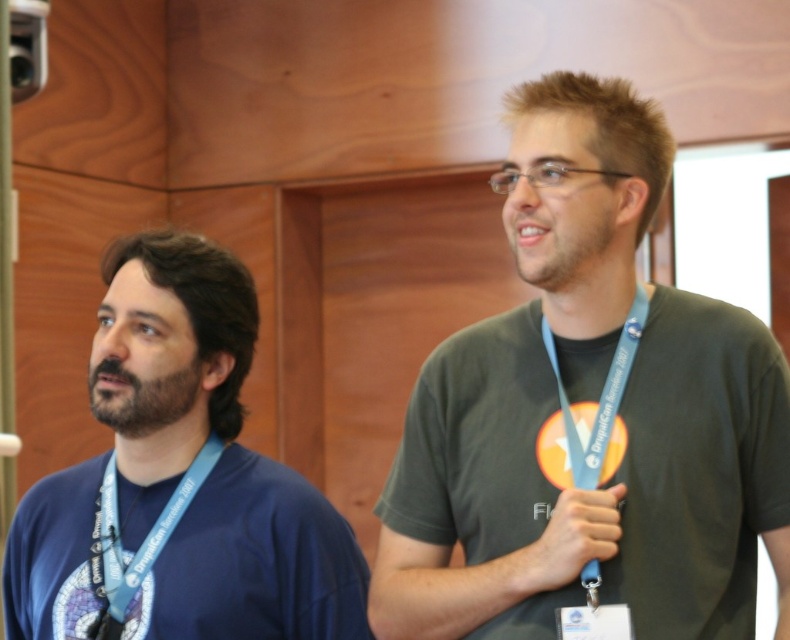
Does matte gray lanyard at center appear under blue fabric lanyard at left?

No, matte gray lanyard at center is not below blue fabric lanyard at left.

From the picture: Who is more distant from viewer, (x=574, y=266) or (x=92, y=572)?

The point (x=92, y=572) is behind.

Does point (576, 328) lie behind point (104, 490)?

No, it is not.

Image resolution: width=790 pixels, height=640 pixels. What are the coordinates of `matte gray lanyard at center` in the screenshot? It's located at pos(585,276).

Looking at this image, does blue fabric lanyard at left appear on the left side of blue fabric lanyard at right?

Correct, you'll find blue fabric lanyard at left to the left of blue fabric lanyard at right.

Is point (122, 580) closer to viewer compared to point (627, 364)?

That is False.

Between point (102, 611) and point (578, 435), which one is positioned in front?

Point (578, 435) is in front.

Where is `blue fabric lanyard at left`? blue fabric lanyard at left is located at coordinates (140, 544).

Does point (608, 304) come farther from viewer compared to point (115, 406)?

That is False.

Which is behind, point (576, 308) or point (166, 404)?

Positioned behind is point (166, 404).

Which is in front, point (574, 300) or point (170, 380)?

Point (574, 300) is more forward.

This screenshot has width=790, height=640. Identify the location of matte gray lanyard at center. (585, 276).